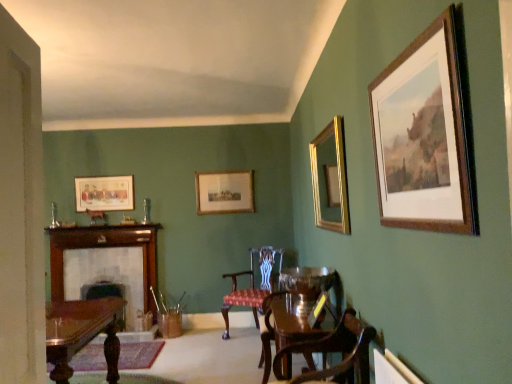
What do you see at coordinates (81, 333) in the screenshot? I see `mahogany polished table at left` at bounding box center [81, 333].

Measure the distance between wooden picture frame at center, the 2th picture frame from the left, and camera.

wooden picture frame at center, the 2th picture frame from the left, is 5.33 meters from camera.

Describe the element at coordinates (252, 285) in the screenshot. This screenshot has height=384, width=512. I see `velvet upholstered chair at center, which is the 1th chair in back-to-front order` at that location.

You are a GUI agent. You are given a task and a screenshot of the screen. Output one action in this format:
    pyautogui.click(x=<x>, y=<y>)
    Task: Click on the gold/gilded mirror at upper right, the second picture frame in the right-to-left sequence
    
    Given the screenshot: What is the action you would take?
    pyautogui.click(x=330, y=178)

At what (x,y) coordinates should I click in order to perform the action: click on wooden fireplace at left. Please return your answer as a coordinate pair (x, y). This screenshot has width=512, height=384. Looking at the image, I should click on (106, 264).

At what (x,y) coordinates should I click in order to perform the action: click on mahogany polished table at left. Please return your answer as a coordinate pair (x, y). This screenshot has width=512, height=384. Looking at the image, I should click on (81, 333).

Is velvet upholstered chair at center, positioned as the 3th chair in front-to-back order, outside of wooden picture frame at center, acting as the 1th picture frame starting from the back?

Absolutely, velvet upholstered chair at center, positioned as the 3th chair in front-to-back order, is external to wooden picture frame at center, acting as the 1th picture frame starting from the back.

How many degrees apart are the facing directions of velvet upholstered chair at center, which is the 1th chair in back-to-front order, and wooden picture frame at center, the 3th picture frame from the right?

There is a 32.2-degree angle between the facing directions of velvet upholstered chair at center, which is the 1th chair in back-to-front order, and wooden picture frame at center, the 3th picture frame from the right.

In the scene shown: Considering the relative positions of velvet upholstered chair at center, which is the 1th chair in back-to-front order, and wooden picture frame at center, acting as the 1th picture frame starting from the back, in the image provided, is velvet upholstered chair at center, which is the 1th chair in back-to-front order, to the left of wooden picture frame at center, acting as the 1th picture frame starting from the back, from the viewer's perspective?

No, velvet upholstered chair at center, which is the 1th chair in back-to-front order, is not to the left of wooden picture frame at center, acting as the 1th picture frame starting from the back.

Which is farther, (225,309) or (206,200)?

Point (206,200)

Is wooden fireplace at left wider than velvet upholstered chair at center, which is the 1th chair in back-to-front order?

No.

Between wooden fireplace at left and velvet upholstered chair at center, which is the 1th chair in back-to-front order, which one has smaller size?

With smaller size is wooden fireplace at left.

Is wooden fireplace at left next to velvet upholstered chair at center, positioned as the 3th chair in front-to-back order?

They are not placed beside each other.

Considering the positions of points (127, 300) and (270, 284), is point (127, 300) closer to camera compared to point (270, 284)?

No, (127, 300) is further to viewer.

Between gold/gilded mirror at upper right, the 3th picture frame when ordered from back to front, and velvet upholstered chair at center, positioned as the 3th chair in front-to-back order, which one has larger width?

With larger width is velvet upholstered chair at center, positioned as the 3th chair in front-to-back order.

Is gold/gilded mirror at upper right, the 2th picture frame viewed from the front, in contact with velvet upholstered chair at center, which is the 1th chair in back-to-front order?

No, gold/gilded mirror at upper right, the 2th picture frame viewed from the front, is not making contact with velvet upholstered chair at center, which is the 1th chair in back-to-front order.

Is gold/gilded mirror at upper right, the 2th picture frame viewed from the front, inside or outside of velvet upholstered chair at center, positioned as the 3th chair in front-to-back order?

The correct answer is: outside.

Does point (148, 282) come farther from viewer compared to point (75, 350)?

Yes, it is.

From a real-world perspective, between wooden fireplace at left and mahogany polished table at left, who is vertically lower?

From a 3D spatial view, mahogany polished table at left is below.

Could you tell me if wooden fireplace at left is turned towards mahogany polished table at left?

Yes, wooden fireplace at left faces towards mahogany polished table at left.

From a real-world perspective, which object stands above the other?

In real-world perspective, wooden picture frame at center, the 3th picture frame from the right, is above.

Who is taller, wooden picture frame at center, acting as the 1th picture frame starting from the back, or wooden polished chair at lower right, the first chair in the front-to-back sequence?

With more height is wooden picture frame at center, acting as the 1th picture frame starting from the back.

Considering the sizes of objects wooden picture frame at center, acting as the 1th picture frame starting from the back, and wooden polished chair at lower right, the 3th chair in the back-to-front sequence, in the image provided, who is smaller, wooden picture frame at center, acting as the 1th picture frame starting from the back, or wooden polished chair at lower right, the 3th chair in the back-to-front sequence,?

With smaller size is wooden picture frame at center, acting as the 1th picture frame starting from the back.

Does point (236, 206) come farther from viewer compared to point (356, 334)?

Yes, point (236, 206) is behind point (356, 334).

How many degrees apart are the facing directions of wooden polished chair at lower right, the first chair in the front-to-back sequence, and wooden fireplace at left?

The facing directions of wooden polished chair at lower right, the first chair in the front-to-back sequence, and wooden fireplace at left are 90.2 degrees apart.

Is wooden polished chair at lower right, the first chair in the front-to-back sequence, oriented towards wooden fireplace at left?

No, wooden polished chair at lower right, the first chair in the front-to-back sequence, does not turn towards wooden fireplace at left.

Is wooden polished chair at lower right, the first chair in the front-to-back sequence, wider or thinner than wooden fireplace at left?

Considering their sizes, wooden polished chair at lower right, the first chair in the front-to-back sequence, looks broader than wooden fireplace at left.

From the picture: In the image, is wooden polished chair at lower right, the first chair in the front-to-back sequence, on the left side or the right side of wooden fireplace at left?

From the image, it's evident that wooden polished chair at lower right, the first chair in the front-to-back sequence, is to the right of wooden fireplace at left.

From a real-world perspective, which picture frame is the 3rd one above the mahogany polished table at left? Please provide its 2D coordinates.

[(224, 192)]

Could you tell me if wooden picture frame at center, the 2th picture frame from the left, is facing mahogany polished table at left?

No.

Are wooden picture frame at center, acting as the 1th picture frame starting from the back, and mahogany polished table at left located far from each other?

Yes.

Locate an element on the screen. The width and height of the screenshot is (512, 384). the 3rd chair below when counting from the wooden picture frame at center, the 2th picture frame from the left (from the image's perspective) is located at coordinates (252, 285).

Identify the location of fireplace on the left of the velvet upholstered chair at center, which is the 1th chair in back-to-front order. The height and width of the screenshot is (384, 512). pyautogui.click(x=106, y=264).

When comparing their distances from wooden polished chair at center, positioned as the second chair in front-to-back order, does mahogany polished table at left or wooden fireplace at left seem closer?

Based on the image, mahogany polished table at left appears to be nearer to wooden polished chair at center, positioned as the second chair in front-to-back order.

Which object lies further to the anchor point gold/gilded mirror at upper right, the second picture frame in the right-to-left sequence, wooden picture frame at upper right, the first picture frame when ordered from right to left, or wooden fireplace at left?

The object further to gold/gilded mirror at upper right, the second picture frame in the right-to-left sequence, is wooden fireplace at left.

Looking at the image, which one is located further to wooden fireplace at left, wooden picture frame at upper right, the fourth picture frame positioned from the back, or velvet upholstered chair at center, which is the 1th chair in back-to-front order?

The object further to wooden fireplace at left is wooden picture frame at upper right, the fourth picture frame positioned from the back.

Consider the image. Looking at the image, which one is located closer to wooden polished chair at center, positioned as the second chair in front-to-back order, velvet upholstered chair at center, positioned as the 3th chair in front-to-back order, or wooden polished chair at lower right, the first chair in the front-to-back sequence?

wooden polished chair at lower right, the first chair in the front-to-back sequence, is closer to wooden polished chair at center, positioned as the second chair in front-to-back order.

Which object lies further to the anchor point wooden polished chair at lower right, the first chair in the front-to-back sequence, wooden picture frame at center, acting as the 1th picture frame starting from the back, or wooden fireplace at left?

wooden fireplace at left is further to wooden polished chair at lower right, the first chair in the front-to-back sequence.

Looking at the image, which one is located closer to wooden polished chair at lower right, the first chair in the front-to-back sequence, matte wooden picture frame at upper left, marked as the 2th picture frame in a back-to-front arrangement, or wooden picture frame at center, acting as the 1th picture frame starting from the back?

wooden picture frame at center, acting as the 1th picture frame starting from the back, is closer to wooden polished chair at lower right, the first chair in the front-to-back sequence.

Based on their spatial positions, is matte wooden picture frame at upper left, the first picture frame from the left, or gold/gilded mirror at upper right, the second picture frame in the right-to-left sequence, further from velvet upholstered chair at center, which is the 1th chair in back-to-front order?

matte wooden picture frame at upper left, the first picture frame from the left, lies further to velvet upholstered chair at center, which is the 1th chair in back-to-front order, than the other object.

When comparing their distances from mahogany polished table at left, does wooden picture frame at upper right, marked as the first picture frame in a front-to-back arrangement, or velvet upholstered chair at center, positioned as the 3th chair in front-to-back order, seem further?

The object further to mahogany polished table at left is wooden picture frame at upper right, marked as the first picture frame in a front-to-back arrangement.

This screenshot has height=384, width=512. Find the location of `chair between mahogany polished table at left and velvet upholstered chair at center, positioned as the 3th chair in front-to-back order, from front to back`. chair between mahogany polished table at left and velvet upholstered chair at center, positioned as the 3th chair in front-to-back order, from front to back is located at coordinates [298, 308].

Identify the location of chair between wooden fireplace at left and wooden polished chair at center, which is the 2th chair in back-to-front order. (252, 285).

The width and height of the screenshot is (512, 384). I want to click on table between wooden polished chair at lower right, the 3th chair in the back-to-front sequence, and wooden fireplace at left, along the z-axis, so click(x=81, y=333).

Find the location of a particular element. chair between wooden picture frame at upper right, marked as the fourth picture frame in a left-to-right arrangement, and wooden polished chair at center, which is the 2th chair in back-to-front order, from front to back is located at coordinates (342, 360).